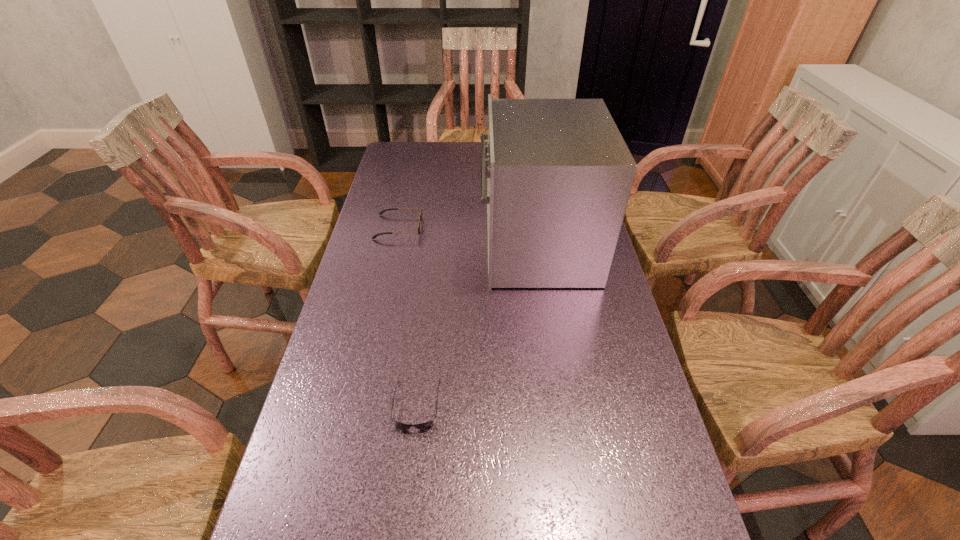
The height and width of the screenshot is (540, 960). I want to click on unoccupied position between the toaster oven and the shorter sunglasses, so click(476, 326).

You are a GUI agent. You are given a task and a screenshot of the screen. Output one action in this format:
    pyautogui.click(x=<x>, y=<y>)
    Task: Click on the free space between the nearer sunglasses and the rightmost object
    
    Given the screenshot: What is the action you would take?
    pyautogui.click(x=476, y=326)

I want to click on free space between the second object from right to left and the taller sunglasses, so click(x=408, y=316).

Locate an element on the screen. The width and height of the screenshot is (960, 540). free space between the farther sunglasses and the right sunglasses is located at coordinates (408, 316).

Find the location of a particular element. The width and height of the screenshot is (960, 540). the second closest object relative to the toaster oven is located at coordinates (429, 424).

Identify which object is located as the nearest to the farther sunglasses. Please provide its 2D coordinates. Your answer should be formatted as a tuple, i.e. [(x, y)], where the tuple contains the x and y coordinates of a point satisfying the conditions above.

[(559, 174)]

I want to click on sunglasses that is the closest to the tallest object, so click(x=421, y=215).

What are the coordinates of `vacant area in the image that satisfies the following two spatial constraints: 1. on the front panel of the toaster oven; 2. on the front-facing side of the second object from right to left` in the screenshot? It's located at (560, 404).

You are a GUI agent. You are given a task and a screenshot of the screen. Output one action in this format:
    pyautogui.click(x=<x>, y=<y>)
    Task: Click on the vacant space that satisfies the following two spatial constraints: 1. on the front panel of the rightmost object; 2. on the front-facing side of the shorter sunglasses
    The image size is (960, 540).
    Given the screenshot: What is the action you would take?
    (560, 404)